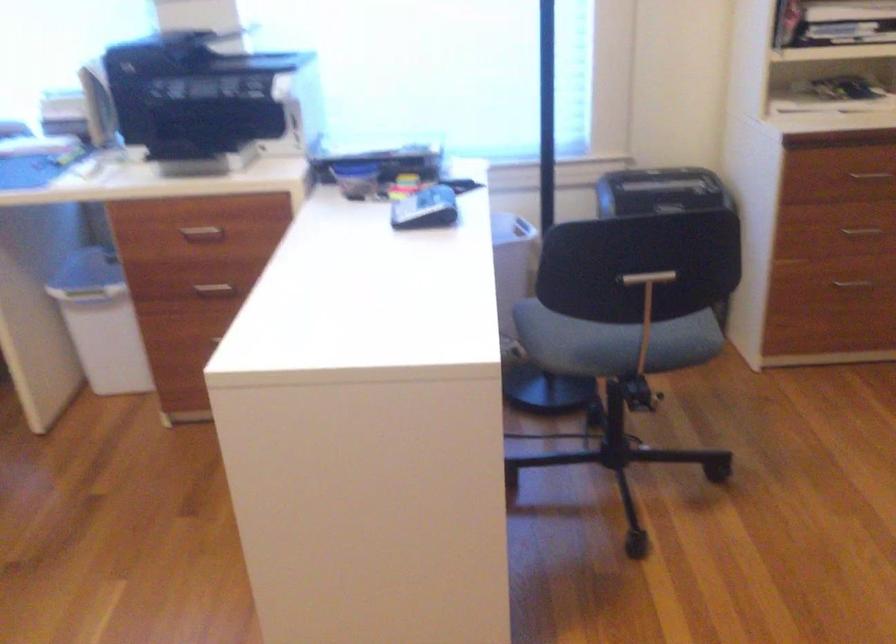
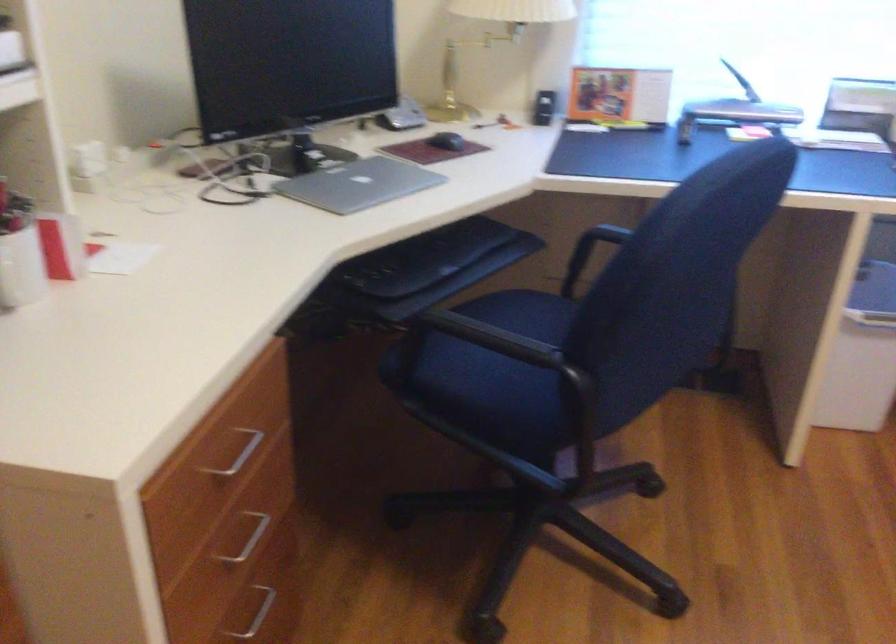
In the second image, find the point that corresponds to pixel 88 327 in the first image.

(862, 355)